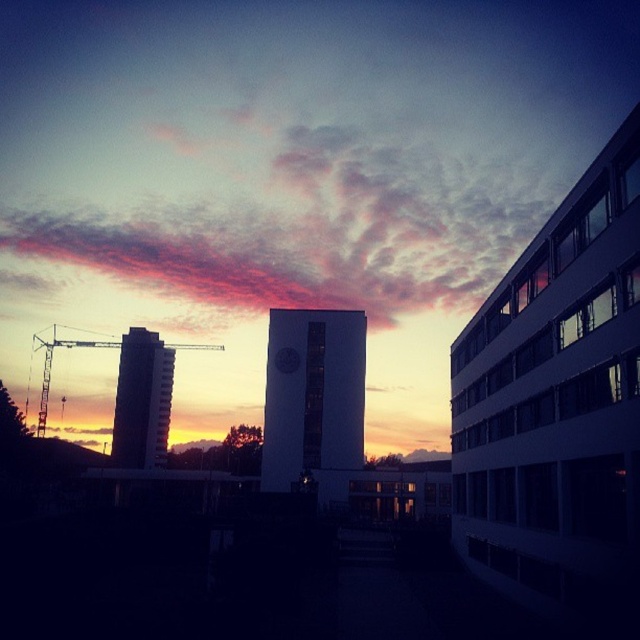
Which of these two, white smooth tower at center or silhouette glass tower at left, stands taller?

With more height is silhouette glass tower at left.

Can you confirm if white smooth tower at center is positioned to the right of silhouette glass tower at left?

Indeed, white smooth tower at center is positioned on the right side of silhouette glass tower at left.

Find the location of `white smooth tower at center`. white smooth tower at center is located at coordinates (312, 394).

What do you see at coordinates (300, 221) in the screenshot? This screenshot has width=640, height=640. I see `pink cotton clouds at upper center` at bounding box center [300, 221].

Does pink cotton clouds at upper center have a greater width compared to silhouette glass tower at left?

Yes.

From the picture: Measure the distance between point (193, 160) and camera.

Point (193, 160) is 308.43 meters from camera.

The image size is (640, 640). What are the coordinates of `pink cotton clouds at upper center` in the screenshot? It's located at (300, 221).

Between point (228, 308) and point (90, 346), which one is positioned behind?

The point (228, 308) is behind.

Does pink cotton clouds at upper center have a lesser height compared to metallic construction crane at left?

Incorrect, pink cotton clouds at upper center's height does not fall short of metallic construction crane at left's.

Who is more distant from viewer, (145, 204) or (44, 429)?

Positioned behind is point (145, 204).

The image size is (640, 640). I want to click on pink cotton clouds at upper center, so click(300, 221).